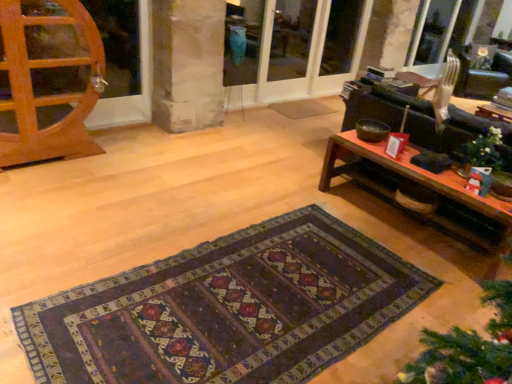
Question: Are transparent glass screen door at upper center, acting as the first screen door starting from the left, and wooden coffee table at right located far from each other?

Choices:
 (A) no
 (B) yes

Answer: (B)

Question: Considering the relative sizes of transparent glass screen door at upper center, acting as the first screen door starting from the left, and wooden coffee table at right in the image provided, is transparent glass screen door at upper center, acting as the first screen door starting from the left, smaller than wooden coffee table at right?

Choices:
 (A) no
 (B) yes

Answer: (B)

Question: Can you confirm if transparent glass screen door at upper center, acting as the first screen door starting from the left, is wider than wooden coffee table at right?

Choices:
 (A) no
 (B) yes

Answer: (A)

Question: Does transparent glass screen door at upper center, the 3th screen door positioned from the right, appear on the right side of wooden coffee table at right?

Choices:
 (A) no
 (B) yes

Answer: (A)

Question: Considering the relative sizes of transparent glass screen door at upper center, acting as the first screen door starting from the left, and wooden coffee table at right in the image provided, is transparent glass screen door at upper center, acting as the first screen door starting from the left, thinner than wooden coffee table at right?

Choices:
 (A) no
 (B) yes

Answer: (B)

Question: Does transparent glass screen door at upper center, acting as the first screen door starting from the left, have a greater height compared to wooden coffee table at right?

Choices:
 (A) yes
 (B) no

Answer: (A)

Question: Is matte glass screen door at center, the second screen door in the left-to-right sequence, at the left side of wooden coffee table at right?

Choices:
 (A) no
 (B) yes

Answer: (B)

Question: Does matte glass screen door at center, the second screen door in the left-to-right sequence, have a lesser height compared to wooden coffee table at right?

Choices:
 (A) no
 (B) yes

Answer: (A)

Question: From a real-world perspective, is matte glass screen door at center, marked as the 2th screen door in a right-to-left arrangement, beneath wooden coffee table at right?

Choices:
 (A) yes
 (B) no

Answer: (B)

Question: From the image's perspective, is matte glass screen door at center, the second screen door in the left-to-right sequence, over wooden coffee table at right?

Choices:
 (A) no
 (B) yes

Answer: (B)

Question: Could wooden coffee table at right be considered to be inside matte glass screen door at center, the second screen door in the left-to-right sequence?

Choices:
 (A) no
 (B) yes

Answer: (A)

Question: Is matte glass screen door at center, the second screen door in the left-to-right sequence, turned away from wooden coffee table at right?

Choices:
 (A) yes
 (B) no

Answer: (B)

Question: Does matte glass screen door at center, marked as the 2th screen door in a right-to-left arrangement, have a smaller size compared to metallic silver armchair at upper right?

Choices:
 (A) no
 (B) yes

Answer: (B)